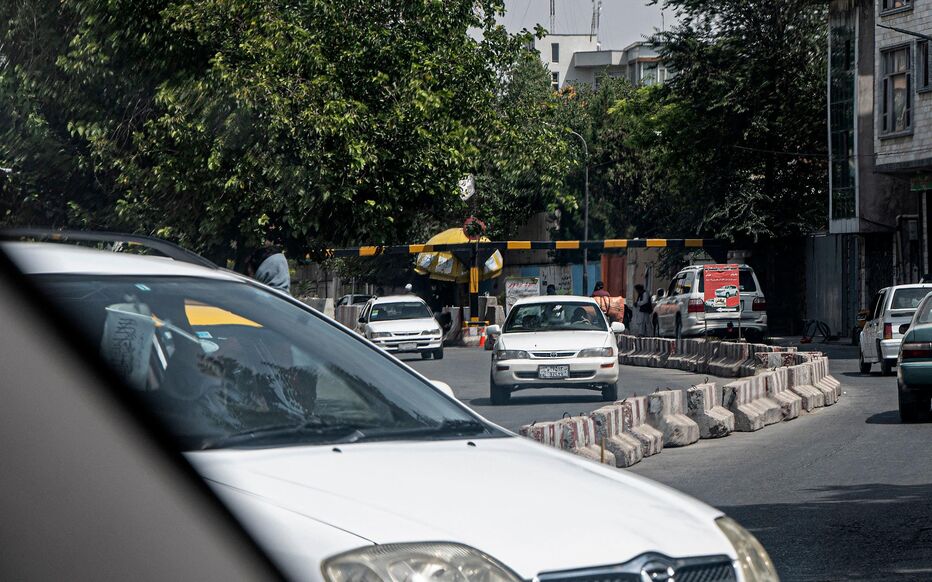
Find the location of a particular element. The image size is (932, 582). windows is located at coordinates (559, 53), (554, 80), (599, 78), (660, 76), (901, 92), (924, 74), (893, 3).